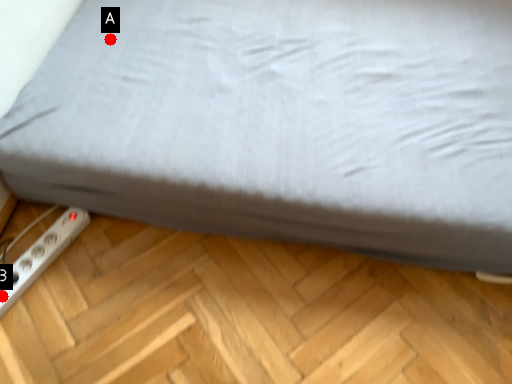
Question: Two points are circled on the image, labeled by A and B beside each circle. Which point is farther to the camera?

Choices:
 (A) A is further
 (B) B is further

Answer: (A)